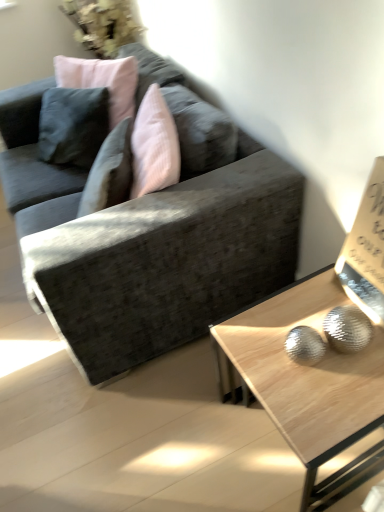
Question: Considering the relative sizes of textured gray couch at center and white paper at upper right in the image provided, is textured gray couch at center wider than white paper at upper right?

Choices:
 (A) yes
 (B) no

Answer: (A)

Question: Can you confirm if textured gray couch at center is positioned to the right of white paper at upper right?

Choices:
 (A) no
 (B) yes

Answer: (A)

Question: Considering the relative sizes of textured gray couch at center and white paper at upper right in the image provided, is textured gray couch at center bigger than white paper at upper right?

Choices:
 (A) no
 (B) yes

Answer: (B)

Question: Considering the relative sizes of textured gray couch at center and white paper at upper right in the image provided, is textured gray couch at center thinner than white paper at upper right?

Choices:
 (A) yes
 (B) no

Answer: (B)

Question: Is textured gray couch at center completely or partially outside of white paper at upper right?

Choices:
 (A) yes
 (B) no

Answer: (A)

Question: From the image's perspective, would you say textured gray couch at center is positioned over white paper at upper right?

Choices:
 (A) yes
 (B) no

Answer: (A)

Question: Is light wood/texture coffee table at lower right touching white paper at upper right?

Choices:
 (A) no
 (B) yes

Answer: (A)

Question: Does light wood/texture coffee table at lower right have a greater height compared to white paper at upper right?

Choices:
 (A) yes
 (B) no

Answer: (A)

Question: From the image's perspective, is light wood/texture coffee table at lower right over white paper at upper right?

Choices:
 (A) yes
 (B) no

Answer: (B)

Question: Would you consider light wood/texture coffee table at lower right to be distant from white paper at upper right?

Choices:
 (A) yes
 (B) no

Answer: (B)

Question: From a real-world perspective, is light wood/texture coffee table at lower right physically above white paper at upper right?

Choices:
 (A) no
 (B) yes

Answer: (A)

Question: Would you say white paper at upper right is part of light wood/texture coffee table at lower right's contents?

Choices:
 (A) no
 (B) yes

Answer: (A)

Question: From a real-world perspective, is white paper at upper right positioned under textured gray couch at center based on gravity?

Choices:
 (A) yes
 (B) no

Answer: (B)